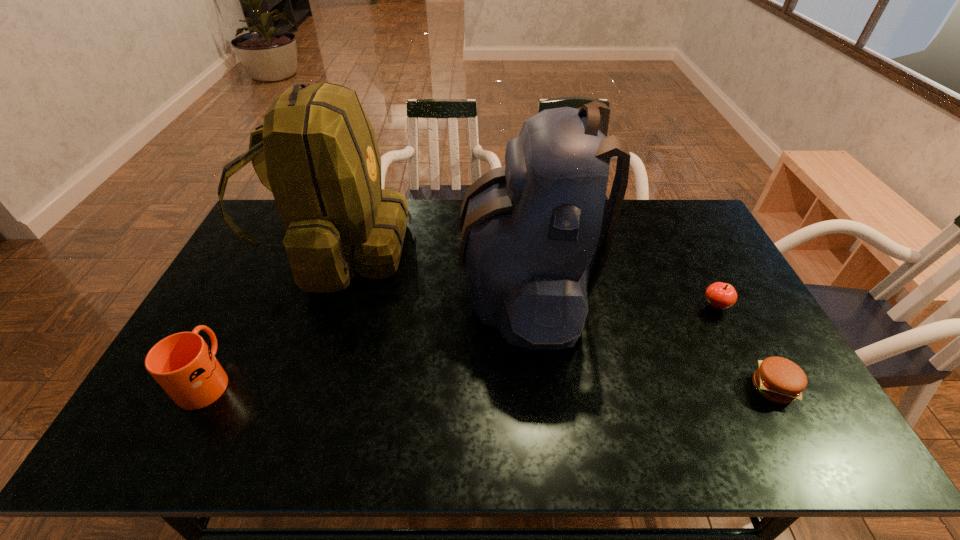
Find the location of a particular element. This screenshot has height=540, width=960. free space at the near edge of the desktop is located at coordinates (469, 447).

In the image, there is a desktop. Where is `free space at the left edge`? This screenshot has height=540, width=960. free space at the left edge is located at coordinates (230, 286).

Identify the location of free space at the right edge. (759, 342).

In the image, there is a desktop. In order to click on vacant space at the near left corner in this screenshot , I will do `click(160, 444)`.

In order to click on free space between the right backpack and the left backpack in this screenshot , I will do `click(430, 268)`.

Identify the location of unoccupied position between the right backpack and the mug. (365, 333).

In order to click on vacant area that lies between the hamburger and the mug in this screenshot , I will do `click(490, 383)`.

At what (x,y) coordinates should I click in order to perform the action: click on vacant region between the hamburger and the apple. Please return your answer as a coordinate pair (x, y). Looking at the image, I should click on (744, 347).

Find the location of a particular element. vacant space in between the left backpack and the third tallest object is located at coordinates (272, 314).

Locate an element on the screen. The height and width of the screenshot is (540, 960). free spot between the second shortest object and the third shortest object is located at coordinates (462, 342).